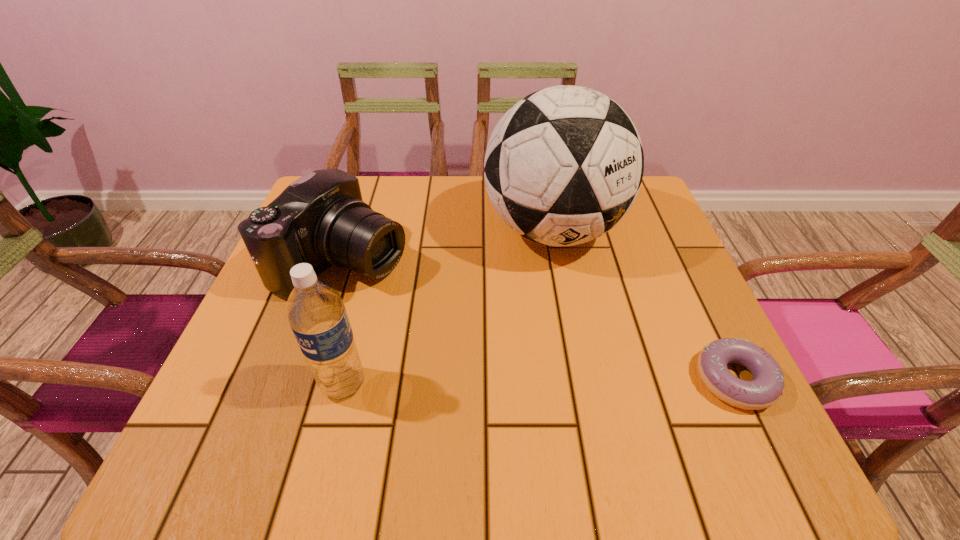
You are a GUI agent. You are given a task and a screenshot of the screen. Output one action in this format:
    pyautogui.click(x=<x>, y=<y>)
    Task: Click on the free spot between the shortest object and the third shortest object
    
    Given the screenshot: What is the action you would take?
    pyautogui.click(x=540, y=382)

The image size is (960, 540). What are the coordinates of `vacant space in between the water bottle and the second object from right to left` in the screenshot? It's located at (448, 307).

The height and width of the screenshot is (540, 960). I want to click on free space between the third object from left to right and the third shortest object, so click(448, 307).

You are a GUI agent. You are given a task and a screenshot of the screen. Output one action in this format:
    pyautogui.click(x=<x>, y=<y>)
    Task: Click on the vacant space in between the rightmost object and the water bottle
    The image size is (960, 540).
    Given the screenshot: What is the action you would take?
    pyautogui.click(x=540, y=382)

I want to click on free spot between the second object from right to left and the second shortest object, so click(448, 246).

The width and height of the screenshot is (960, 540). What are the coordinates of `object that stands as the second closest to the shortest object` in the screenshot? It's located at (321, 219).

Select which object appears as the closest to the third tallest object. Please provide its 2D coordinates. Your answer should be formatted as a tuple, i.e. [(x, y)], where the tuple contains the x and y coordinates of a point satisfying the conditions above.

[(317, 315)]

You are a GUI agent. You are given a task and a screenshot of the screen. Output one action in this format:
    pyautogui.click(x=<x>, y=<y>)
    Task: Click on the vacant region that satisfies the following two spatial constraints: 1. on the front side of the water bottle; 2. on the right side of the camera
    This screenshot has height=540, width=960.
    Given the screenshot: What is the action you would take?
    pyautogui.click(x=303, y=384)